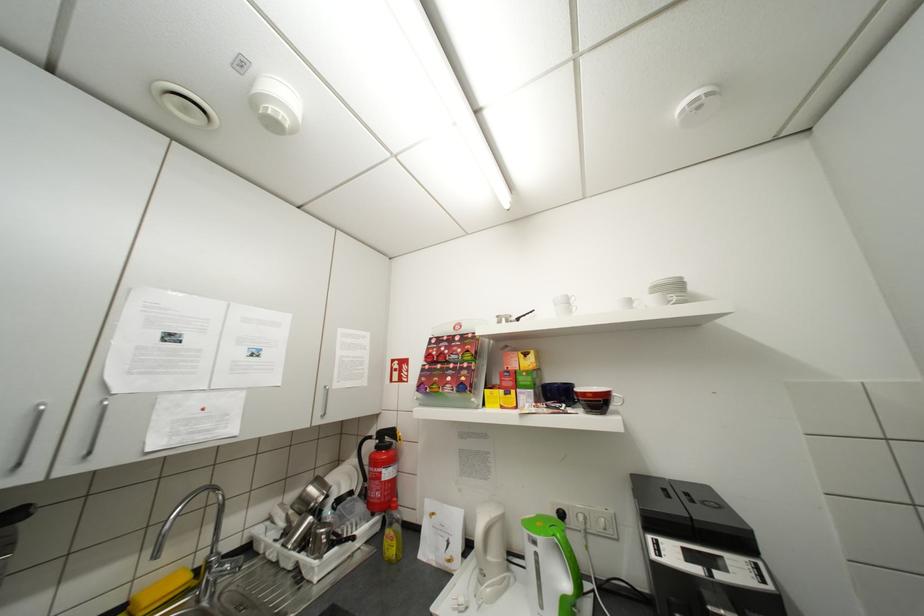
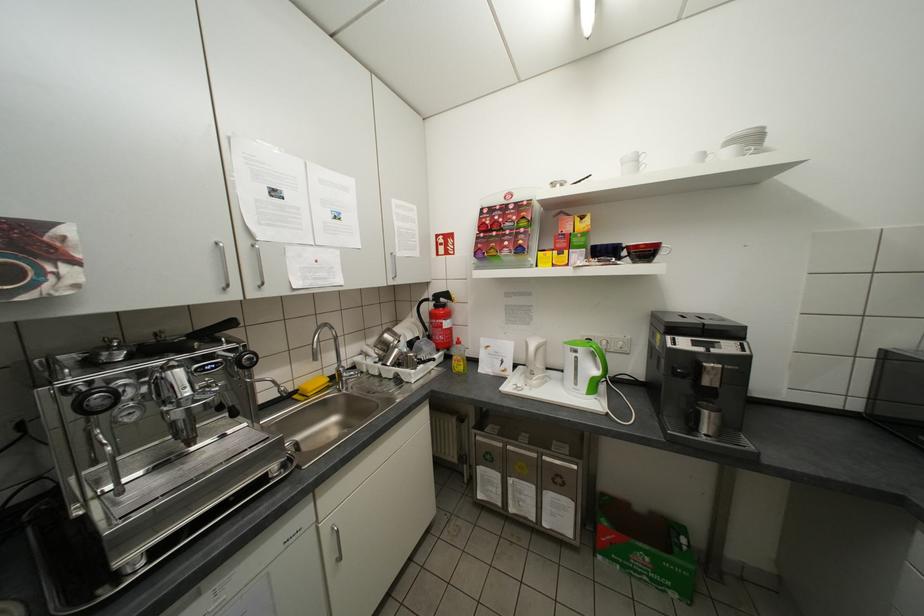
Where in the second image is the point corresponding to [201,576] from the first image?

(336, 379)